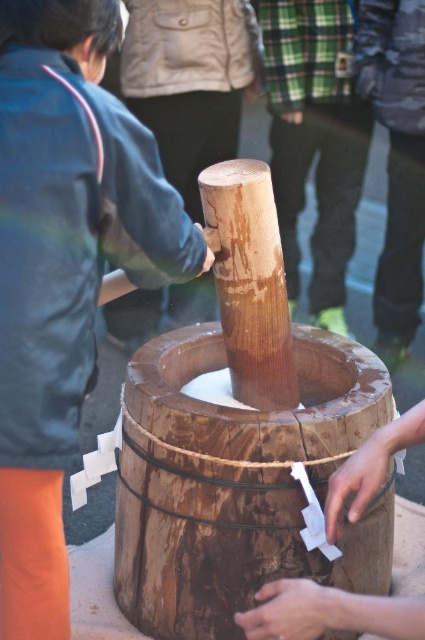
Who is lower down, dark blue jacket at left or wooden barrel at center?

wooden barrel at center

Which of these two, dark blue jacket at left or wooden barrel at center, stands shorter?

wooden barrel at center is shorter.

The height and width of the screenshot is (640, 425). I want to click on dark blue jacket at left, so click(64, 273).

This screenshot has width=425, height=640. What do you see at coordinates (64, 273) in the screenshot? I see `dark blue jacket at left` at bounding box center [64, 273].

Who is shorter, dark blue jacket at left or wooden hand at center?

Standing shorter between the two is wooden hand at center.

What do you see at coordinates (64, 273) in the screenshot? I see `dark blue jacket at left` at bounding box center [64, 273].

Where is `dark blue jacket at left`? The image size is (425, 640). dark blue jacket at left is located at coordinates (64, 273).

Does point (260, 506) lie behind point (413, 621)?

Yes.

The image size is (425, 640). I want to click on wooden barrel at center, so click(x=238, y=483).